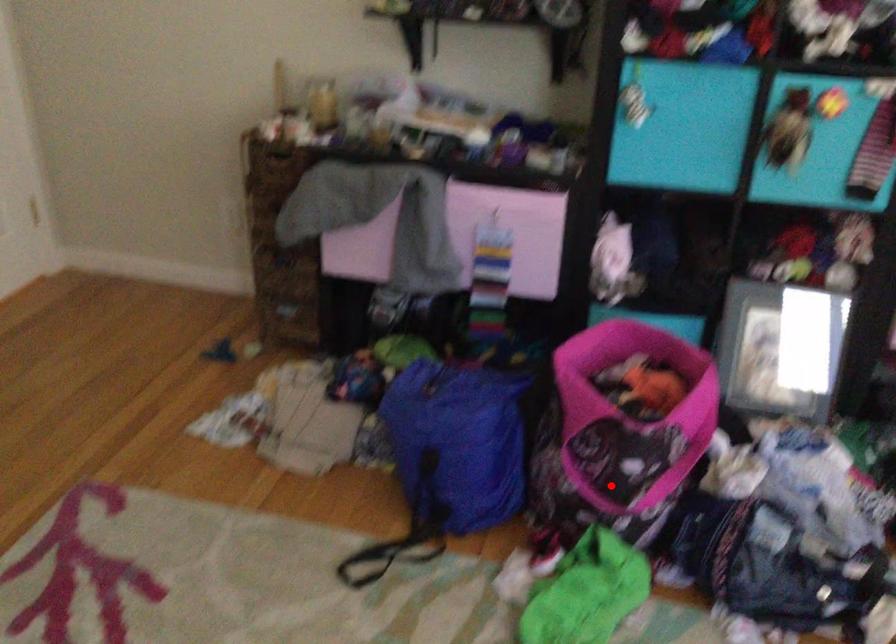
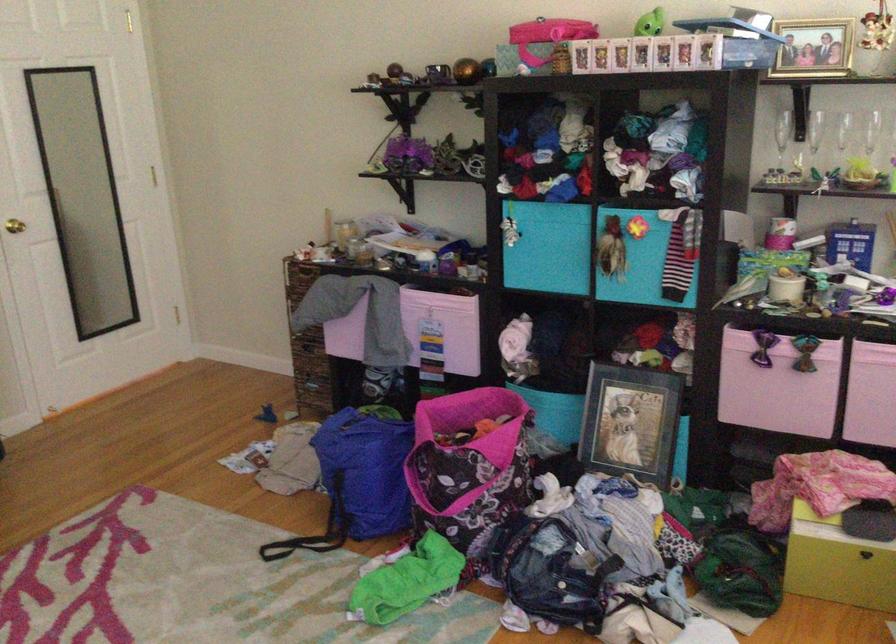
Question: I am providing you with two images of the same scene from different viewpoints. Image1 has a red point marked. In image2, the corresponding 3D location appears at what relative position? Reply with the corresponding letter.

Choices:
 (A) Closer
 (B) Farther

Answer: (B)